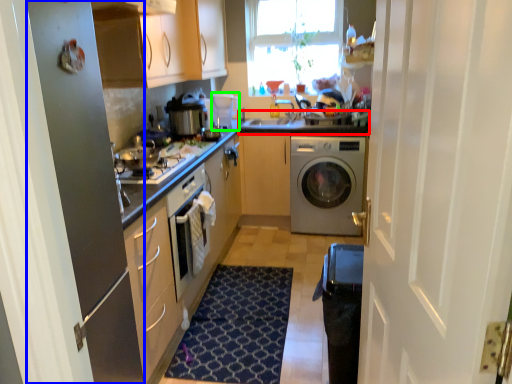
Question: Which object is the farthest from counter top (highlighted by a red box)? Choose among these: screen door (highlighted by a blue box) or appliance (highlighted by a green box).

Choices:
 (A) screen door
 (B) appliance

Answer: (A)